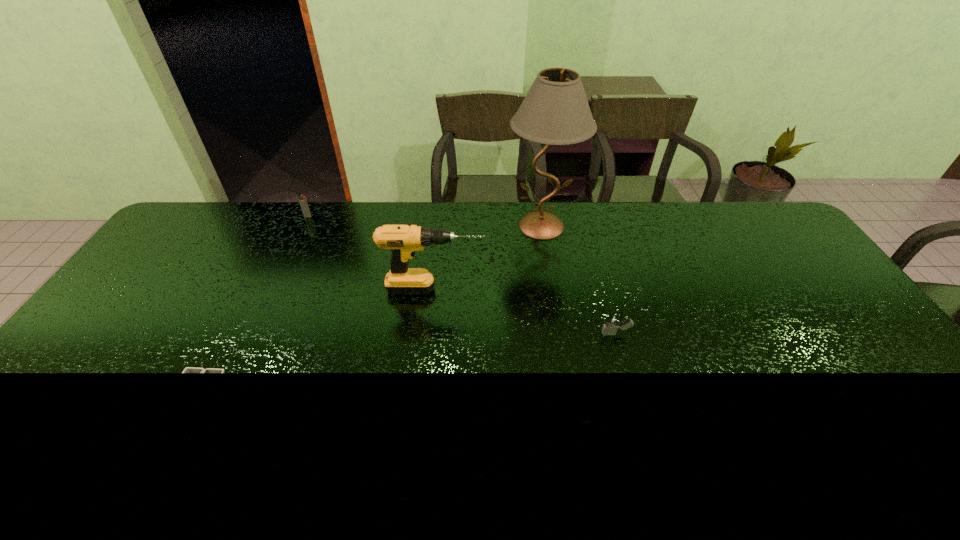
Where is `table lamp`? table lamp is located at coordinates (555, 111).

Identify the location of the third object from right to left. (404, 240).

Image resolution: width=960 pixels, height=540 pixels. Identify the location of drill. (404, 240).

At what (x,y) coordinates should I click in order to perform the action: click on the farther igniter. Please return your answer as a coordinate pair (x, y). The image size is (960, 540). Looking at the image, I should click on (302, 200).

Locate an element on the screen. Image resolution: width=960 pixels, height=540 pixels. the right igniter is located at coordinates click(x=611, y=324).

At what (x,y) coordinates should I click in order to perform the action: click on the nearer igniter. Please return your answer as a coordinate pair (x, y). Looking at the image, I should click on (611, 324).

Locate an element on the screen. ashtray is located at coordinates (188, 369).

You are a GUI agent. You are given a task and a screenshot of the screen. Output one action in this format:
    pyautogui.click(x=<x>, y=<y>)
    Task: Click on the shortest object
    
    Given the screenshot: What is the action you would take?
    pyautogui.click(x=188, y=369)

This screenshot has width=960, height=540. In order to click on vacant space located on the front-facing side of the tallest object in this screenshot , I will do `click(552, 293)`.

You are a GUI agent. You are given a task and a screenshot of the screen. Output one action in this format:
    pyautogui.click(x=<x>, y=<y>)
    Task: Click on the free space located at the tip of the drill
    The height and width of the screenshot is (540, 960).
    Given the screenshot: What is the action you would take?
    pyautogui.click(x=613, y=289)